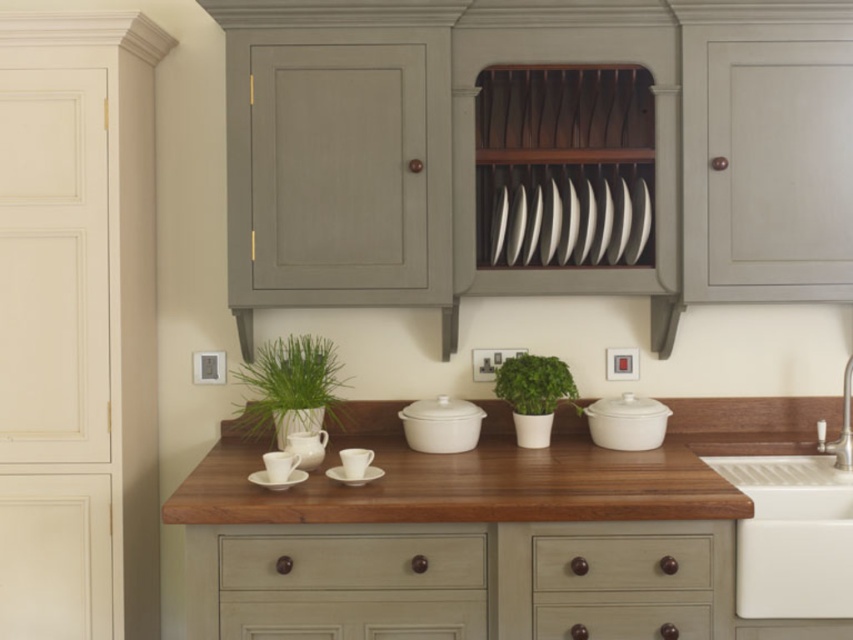
Question: Does brown wood drawer at center appear on the left side of green matte plant at center?

Choices:
 (A) yes
 (B) no

Answer: (B)

Question: Is matte gray drawer at lower center wider than green matte plant at left?

Choices:
 (A) yes
 (B) no

Answer: (A)

Question: In this image, where is matte gray drawer at lower center located relative to light wood/dark finish drawer at center?

Choices:
 (A) right
 (B) left

Answer: (A)

Question: Among these points, which one is nearest to the camera?

Choices:
 (A) (689, 600)
 (B) (606, 467)
 (C) (397, 588)

Answer: (A)

Question: Considering the real-world distances, which object is farthest from the white glossy plate at center?

Choices:
 (A) white ceramic sink at lower right
 (B) green matte plant at center

Answer: (A)

Question: Among these objects, which one is farthest from the camera?

Choices:
 (A) white glossy plate at center
 (B) white ceramic sink at lower right
 (C) matte gray drawer at lower center

Answer: (A)